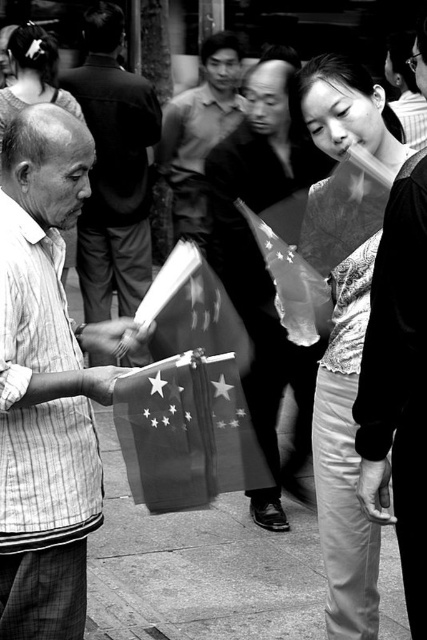
You are a photographer who needs to retrieve your camera to capture a moment. You are standing at the center of the image and see the smooth black bag at center and the camera. Which object is closer to you?

The smooth black bag at center is closer to you since it is only 9.91 feet away from the camera, which is farther away.

You are a photographer analyzing the composition of this black and white photo. The scene has two people in the foreground interacting. There is a point marked at coordinates [263,262]. What object is located at this point?

The point at coordinates [263,262] marks the location of the smooth black bag at center.